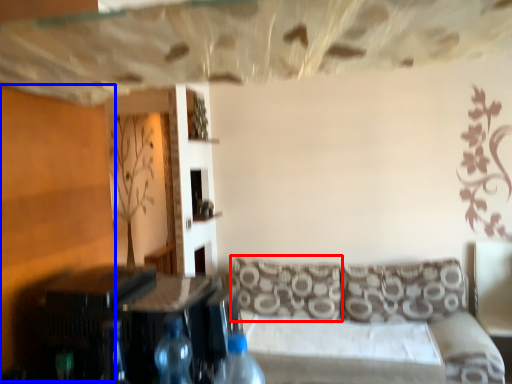
Question: Among these objects, which one is farthest to the camera, pillow (highlighted by a red box) or plywood (highlighted by a blue box)?

Choices:
 (A) pillow
 (B) plywood

Answer: (A)